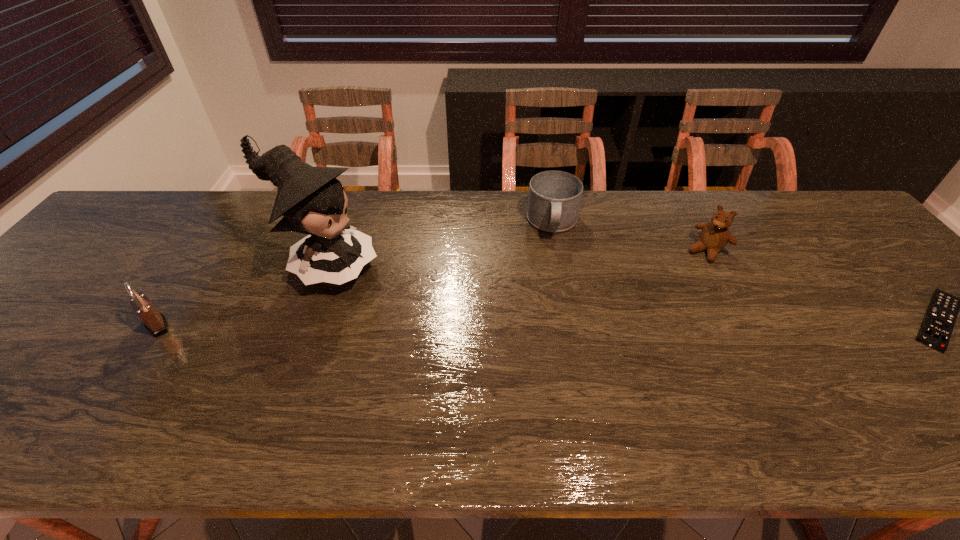
Find the location of a particular element. free space located at the face of the tallest object is located at coordinates (472, 330).

You are a GUI agent. You are given a task and a screenshot of the screen. Output one action in this format:
    pyautogui.click(x=<x>, y=<y>)
    Task: Click on the free space located at the face of the tallest object
    Image resolution: width=960 pixels, height=540 pixels.
    Given the screenshot: What is the action you would take?
    pyautogui.click(x=430, y=310)

The width and height of the screenshot is (960, 540). Identify the location of vacant space situated 0.100m at the face of the teddy bear. (681, 279).

Identify the location of vacant space located at the face of the teddy bear. The image size is (960, 540). (671, 289).

This screenshot has height=540, width=960. I want to click on vacant space situated 0.250m at the face of the teddy bear, so click(x=652, y=310).

At what (x,y) coordinates should I click in order to perform the action: click on mug at the far edge. Please return your answer as a coordinate pair (x, y). The width and height of the screenshot is (960, 540). Looking at the image, I should click on (554, 199).

Locate an element on the screen. teddy bear that is at the far edge is located at coordinates (714, 236).

Identify the location of free space at the far edge. (616, 214).

Locate an element on the screen. This screenshot has width=960, height=540. free space at the left edge of the desktop is located at coordinates (x=79, y=260).

In the image, there is a desktop. Where is `free space at the right edge`? This screenshot has width=960, height=540. free space at the right edge is located at coordinates (898, 296).